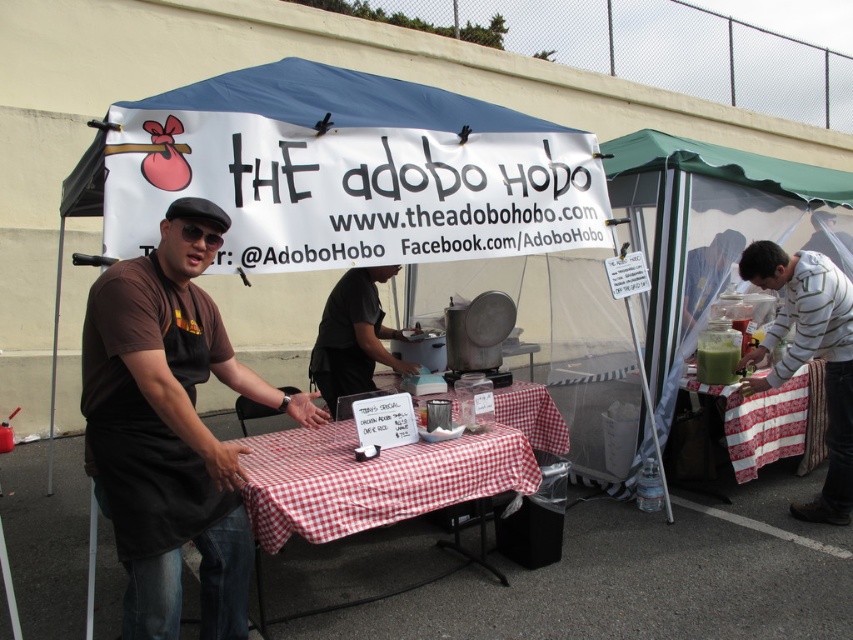
Is red checkered tablecloth at center bigger than white striped sweater at right?

Correct, red checkered tablecloth at center is larger in size than white striped sweater at right.

Between point (372, 488) and point (740, 364), which one is positioned behind?

Point (740, 364)

I want to click on red checkered tablecloth at center, so pos(387,476).

Is point (819, 433) more distant than point (341, 381)?

Yes.

Between green plastic pitcher at right and black matte shirt at center, which one is positioned lower?

Positioned lower is green plastic pitcher at right.

Between point (746, 428) and point (314, 376), which one is positioned behind?

Positioned behind is point (314, 376).

The height and width of the screenshot is (640, 853). Find the location of `green plastic pitcher at right`. green plastic pitcher at right is located at coordinates (772, 420).

Which is in front, point (193, 316) or point (329, 298)?

Point (193, 316)

Can you confirm if brown matte apron at center is smaller than black matte shirt at center?

Incorrect, brown matte apron at center is not smaller in size than black matte shirt at center.

Measure the distance between point (257,400) and camera.

9.36 feet

The height and width of the screenshot is (640, 853). I want to click on brown matte apron at center, so click(x=170, y=428).